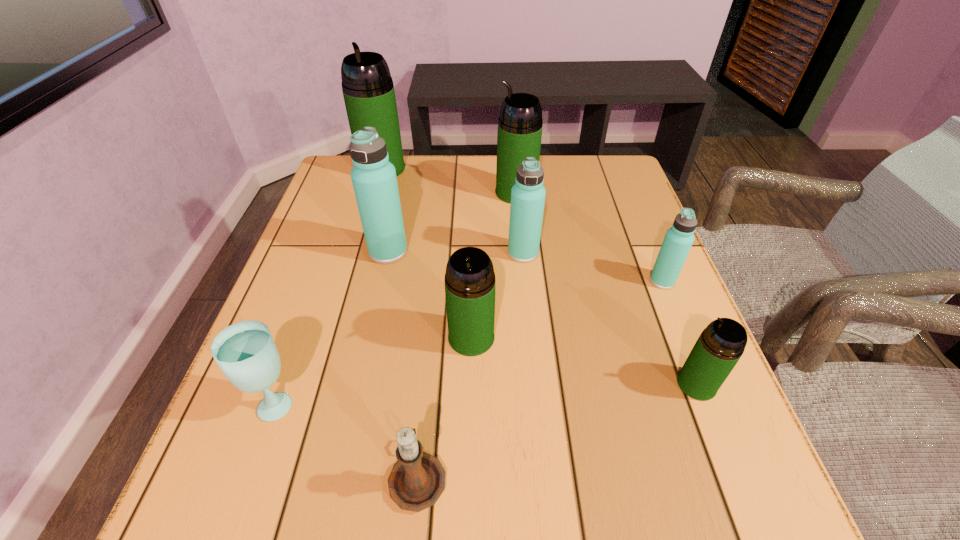
Image resolution: width=960 pixels, height=540 pixels. Find the location of `the second closest aqua thermos bottle to the nearest object`. the second closest aqua thermos bottle to the nearest object is located at coordinates (528, 194).

Choose which aqua thermos bottle is the nearest neighbor to the nearest aqua thermos bottle. Please provide its 2D coordinates. Your answer should be formatted as a tuple, i.e. [(x, y)], where the tuple contains the x and y coordinates of a point satisfying the conditions above.

[(528, 194)]

Where is `free location that satisfies the following two spatial constraints: 1. on the front side of the fifth farthest object; 2. from the spout of the nearest green thermos bottle`? The height and width of the screenshot is (540, 960). free location that satisfies the following two spatial constraints: 1. on the front side of the fifth farthest object; 2. from the spout of the nearest green thermos bottle is located at coordinates (705, 384).

This screenshot has height=540, width=960. Identify the location of vacant area that satisfies the following two spatial constraints: 1. on the front side of the rightmost aqua thermos bottle; 2. on the right side of the biggest aqua thermos bottle. (382, 281).

The image size is (960, 540). In order to click on free region that satisfies the following two spatial constraints: 1. from the spout of the tallest object; 2. on the left side of the second smallest aqua thermos bottle in this screenshot , I will do `click(357, 253)`.

Locate an element on the screen. The height and width of the screenshot is (540, 960). free location that satisfies the following two spatial constraints: 1. from the spout of the second aqua thermos bottle from right to left; 2. on the left side of the tallest thermos bottle is located at coordinates (357, 253).